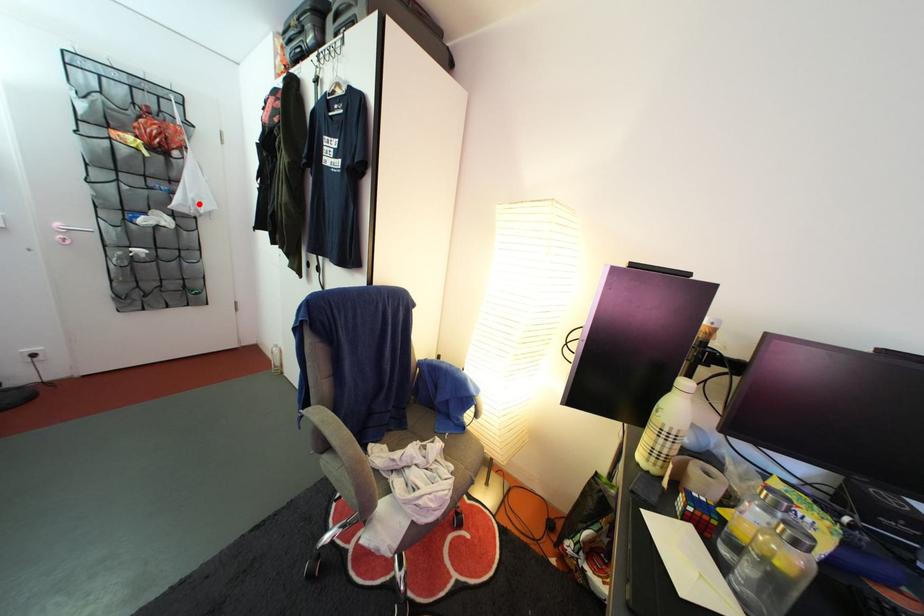
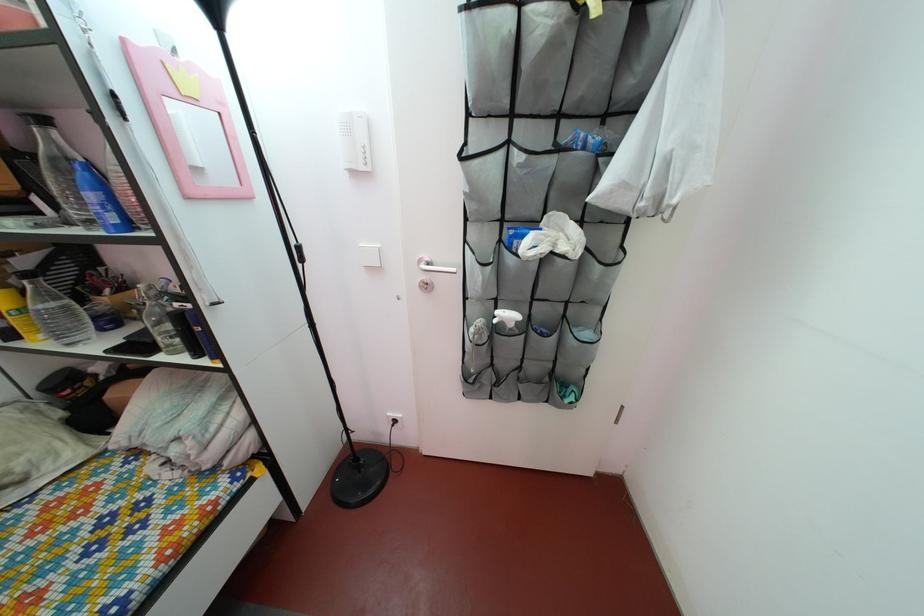
Locate, in the second image, the point that corresponds to the highlighted location in the first image.

(675, 152)